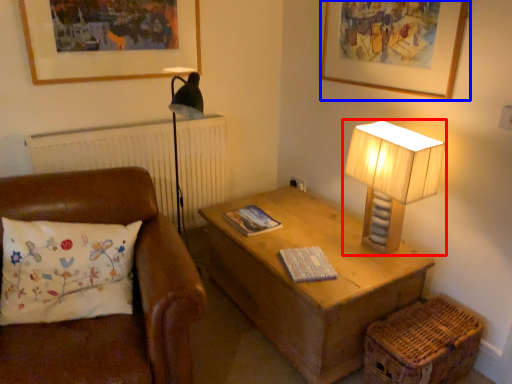
Question: Among these objects, which one is farthest to the camera, lamp (highlighted by a red box) or picture frame (highlighted by a blue box)?

Choices:
 (A) lamp
 (B) picture frame

Answer: (A)